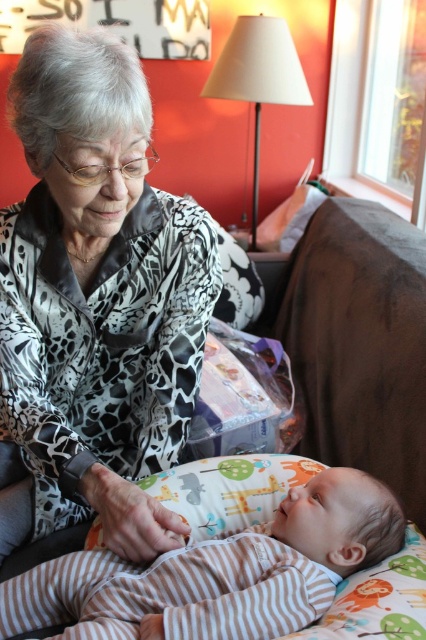
Question: Among these points, which one is nearest to the camera?

Choices:
 (A) (14, 620)
 (B) (195, 237)

Answer: (A)

Question: Which object is farther from the camera taking this photo?

Choices:
 (A) striped cotton onesie at lower center
 (B) white fabric lampshade at upper center

Answer: (B)

Question: Is silky leopard print blouse at center positioned before white fabric lampshade at upper center?

Choices:
 (A) yes
 (B) no

Answer: (A)

Question: Where is silky leopard print blouse at center located in relation to white fabric lampshade at upper center in the image?

Choices:
 (A) right
 (B) left

Answer: (B)

Question: Observing the image, what is the correct spatial positioning of striped cotton onesie at lower center in reference to white fabric lampshade at upper center?

Choices:
 (A) left
 (B) right

Answer: (A)

Question: Which object is closer to the camera taking this photo?

Choices:
 (A) white fabric lampshade at upper center
 (B) silky leopard print blouse at center
 (C) striped cotton onesie at lower center

Answer: (C)